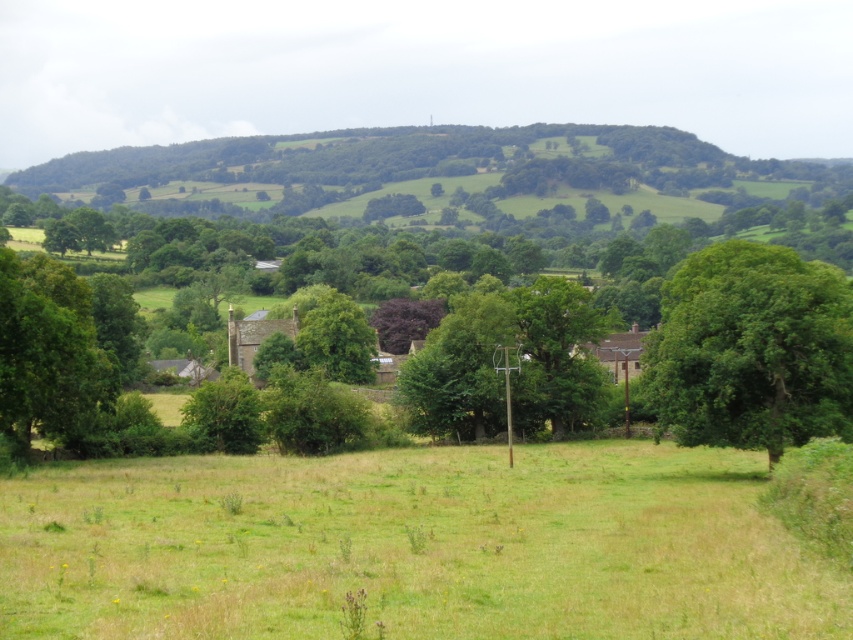
Question: Does green grass at lower center have a lesser width compared to green leafy tree at right?

Choices:
 (A) yes
 (B) no

Answer: (A)

Question: Is green grass at lower center above green leafy tree at left?

Choices:
 (A) no
 (B) yes

Answer: (A)

Question: Can you confirm if green leafy tree at right is bigger than green leafy tree at left?

Choices:
 (A) no
 (B) yes

Answer: (B)

Question: Which object appears farthest from the camera in this image?

Choices:
 (A) green grass at lower center
 (B) green leafy tree at right

Answer: (B)

Question: Which object appears closest to the camera in this image?

Choices:
 (A) green leafy tree at right
 (B) green leafy tree at left
 (C) green grass at lower center

Answer: (C)

Question: Which of the following is the closest to the observer?

Choices:
 (A) (753, 515)
 (B) (51, 422)

Answer: (A)